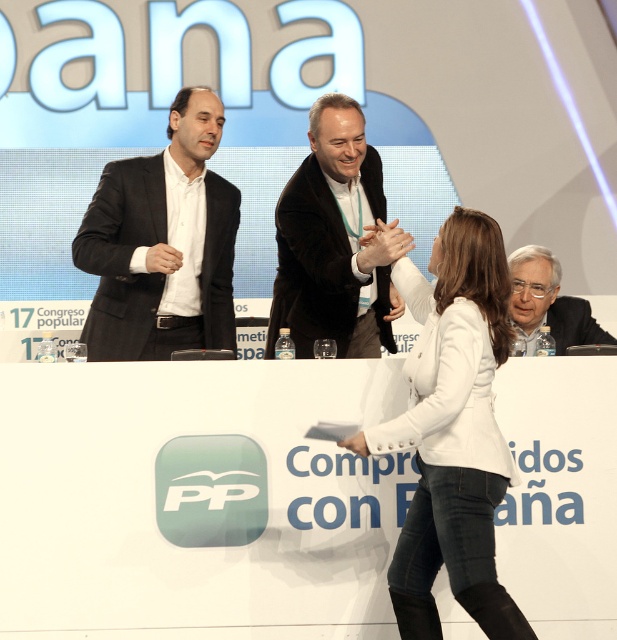
Question: Does velvet black suit at center have a lesser width compared to white textured suit at lower right?

Choices:
 (A) no
 (B) yes

Answer: (A)

Question: Does white textured suit at lower right appear over matte black hand at center?

Choices:
 (A) no
 (B) yes

Answer: (A)

Question: Which point is farther from the camera taking this photo?

Choices:
 (A) (375, 237)
 (B) (337, 326)
 (C) (162, 332)

Answer: (B)

Question: Is black matte suit at left above matte black hand at center?

Choices:
 (A) yes
 (B) no

Answer: (A)

Question: Which object is the farthest from the matte black hand at center?

Choices:
 (A) black matte suit at left
 (B) white leather jacket at center
 (C) velvet black suit at center
 (D) matte black suit at upper left

Answer: (A)

Question: Which point is closer to the camera?

Choices:
 (A) (405, 246)
 (B) (336, 150)
 (C) (160, 250)

Answer: (A)